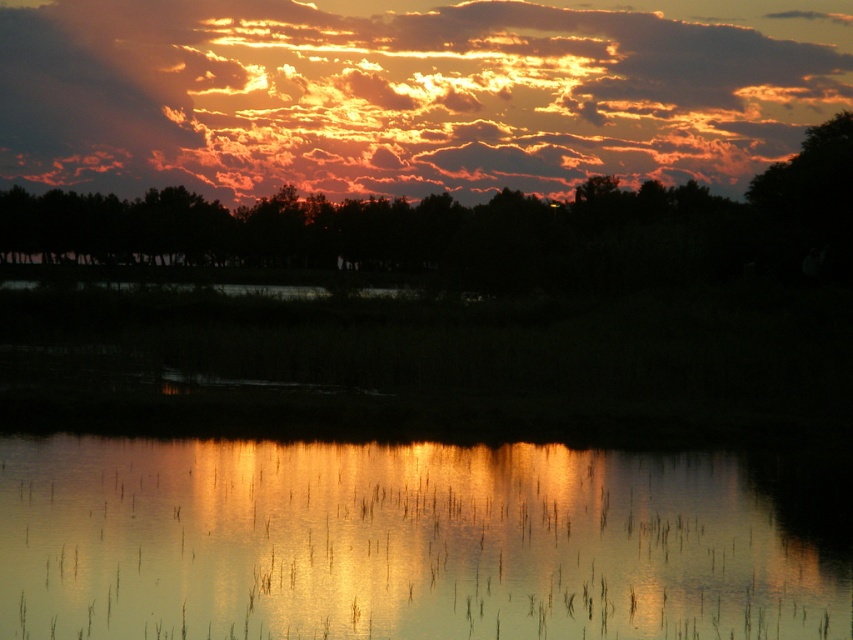
Question: Which of these objects is positioned farthest from the glistening water at center?

Choices:
 (A) dark green leafy tree at center
 (B) golden textured clouds at upper center

Answer: (B)

Question: Can you confirm if glistening water at center is smaller than golden textured clouds at upper center?

Choices:
 (A) no
 (B) yes

Answer: (B)

Question: Does golden textured clouds at upper center lie in front of dark green leafy tree at center?

Choices:
 (A) yes
 (B) no

Answer: (B)

Question: Which point is farther from the camera taking this photo?

Choices:
 (A) (399, 218)
 (B) (223, 28)

Answer: (B)

Question: Among these objects, which one is nearest to the camera?

Choices:
 (A) golden textured clouds at upper center
 (B) glistening water at center

Answer: (B)

Question: Does golden textured clouds at upper center lie in front of dark green leafy tree at center?

Choices:
 (A) yes
 (B) no

Answer: (B)